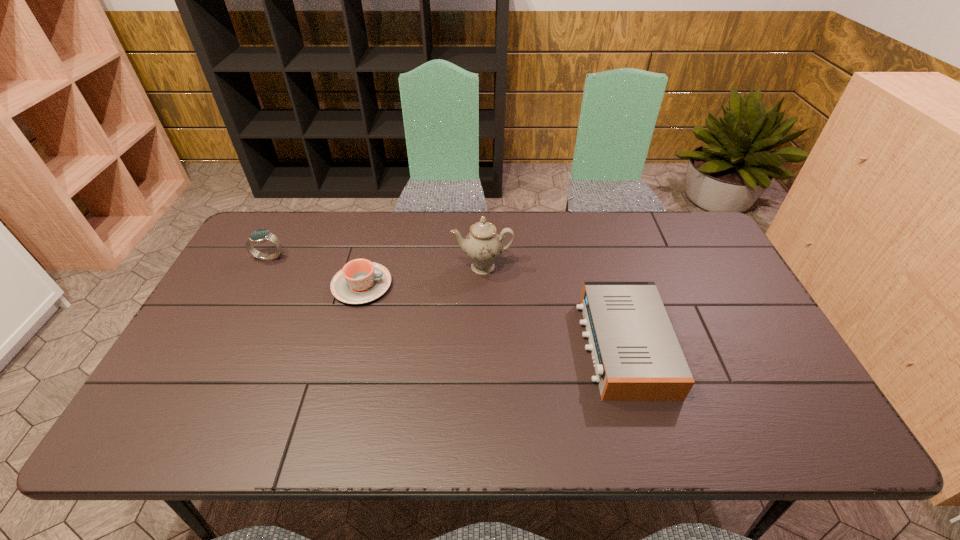
Find the location of a particular element. The width and height of the screenshot is (960, 540). free space between the shortest object and the rightmost object is located at coordinates (492, 316).

Find the location of a particular element. free spot between the radio receiver and the right chinaware is located at coordinates (553, 307).

I want to click on empty space between the second tallest object and the shortest object, so click(x=316, y=272).

Choose which object is the second nearest neighbor to the tallest object. Please provide its 2D coordinates. Your answer should be formatted as a tuple, i.e. [(x, y)], where the tuple contains the x and y coordinates of a point satisfying the conditions above.

[(637, 357)]

Find the location of a particular element. This screenshot has width=960, height=540. object that is the closest one to the rightmost object is located at coordinates (483, 245).

Locate an element on the screen. This screenshot has width=960, height=540. vacant space that satisfies the following two spatial constraints: 1. on the spout of the third object from left to right; 2. on the handle side of the left chinaware is located at coordinates (483, 286).

Locate an element on the screen. vacant area in the image that satisfies the following two spatial constraints: 1. on the spout of the second object from right to left; 2. on the handle side of the shortest object is located at coordinates (483, 286).